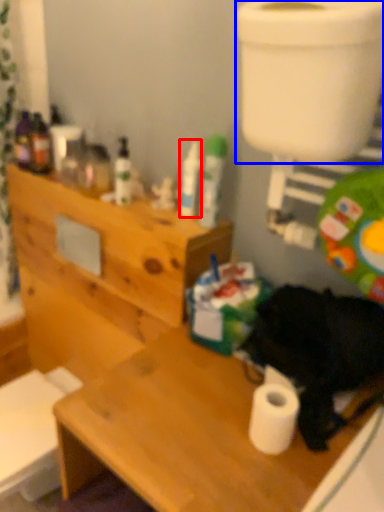
Question: Which object appears farthest to the camera in this image, toiletry (highlighted by a red box) or toilet bowl (highlighted by a blue box)?

Choices:
 (A) toiletry
 (B) toilet bowl

Answer: (A)